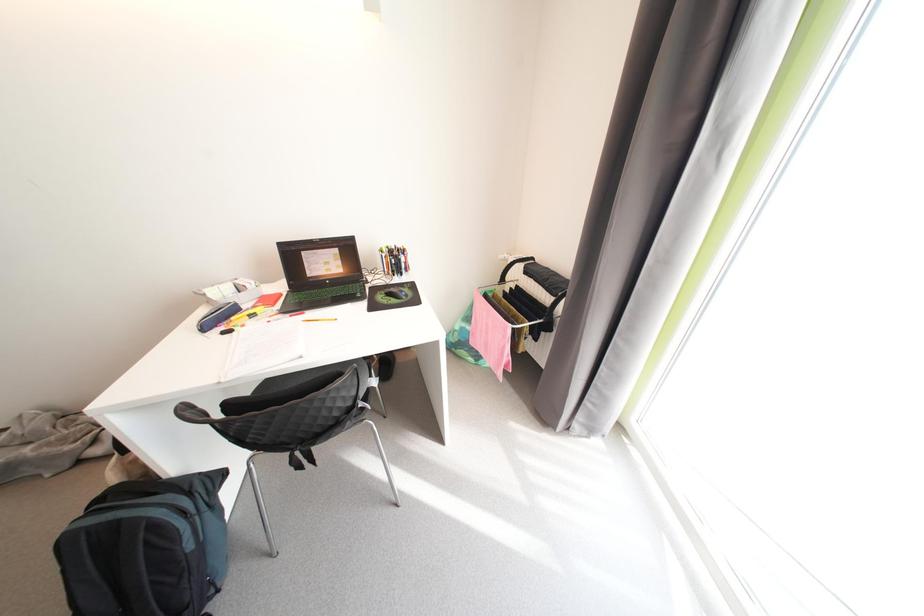
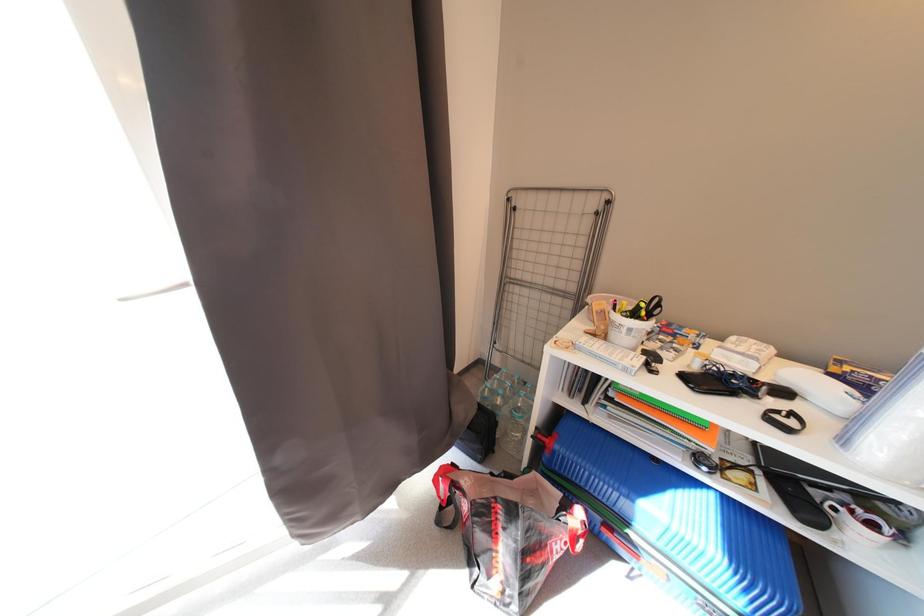
Based on the continuous images, in which direction is the camera rotating?

The rotation direction of the camera is right-down.